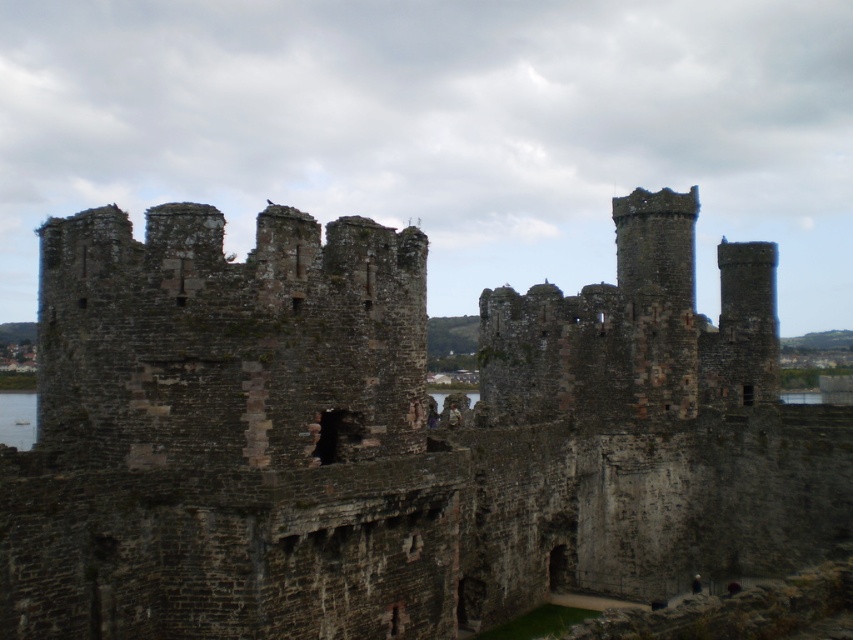
You are a tourist visiting the medieval castle ruins. You notice the dark stone castle at center and the camouflage fabric person at center in the image. Which object is taller?

The dark stone castle at center is much taller than the camouflage fabric person at center.

You are standing at the edge of the medieval castle ruins and see the dark stone castle at center and the camouflage fabric person at center. Which object is positioned more to the left?

The camouflage fabric person at center is positioned more to the left than the dark stone castle at center, as the castle is to the right of the person.

You are standing at the edge of a forest near the dark stone castle at center. You want to cross a small river that flows between you and the castle. If the river is 120 feet wide, will you be able to reach the castle without getting wet?

The dark stone castle at center is 134.34 feet away from the viewer. Since the river is only 120 feet wide, the distance to the castle is greater than the river width. Therefore, after crossing the river, you would still need to cover an additional 14.34 feet to reach the castle. However, the question only asks if you can reach the castle without getting wet. If the river is 120 feet wide and you can cross it somehow, you would get wet while crossing. The answer should focus on whether the river width is a